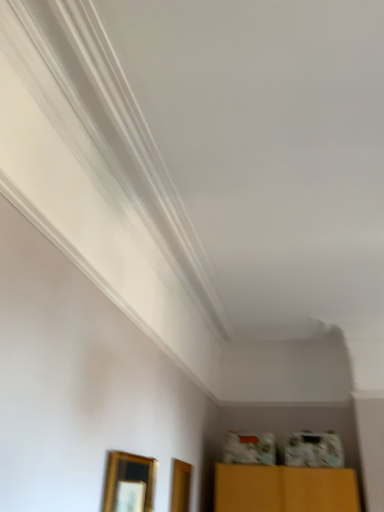
Measure the distance between point (116,461) and camera.

The depth of point (116,461) is 6.52 feet.

Identify the location of gold metallic picture frame at lower left. (129, 483).

What do you see at coordinates (129, 483) in the screenshot? This screenshot has width=384, height=512. I see `gold metallic picture frame at lower left` at bounding box center [129, 483].

Identify the location of gold metallic picture frame at lower left. (129, 483).